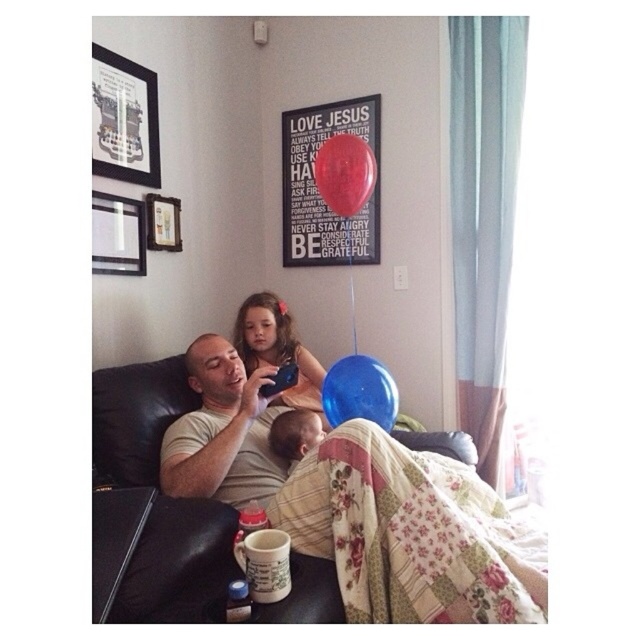
You are a guest in the living room and want to place a new photo frame on the wall between the existing matte black picture frame at upper left and the shiny red balloon at upper center. Is there enough space between them to fit the new frame?

The matte black picture frame at upper left is to the left of the shiny red balloon at upper center, so there is space between them to place the new photo frame.

You are a guest in the living room and want to hang a new painting. You notice the matte black picture frame at upper left and the shiny red balloon at upper center. Which object is located higher up in the room?

The matte black picture frame at upper left is positioned over the shiny red balloon at upper center, meaning it is higher up in the room.